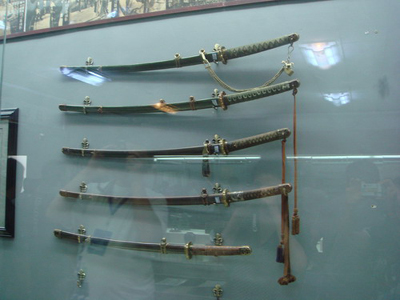
Image resolution: width=400 pixels, height=300 pixels. In order to click on handle in this screenshot , I will do `click(260, 94)`.